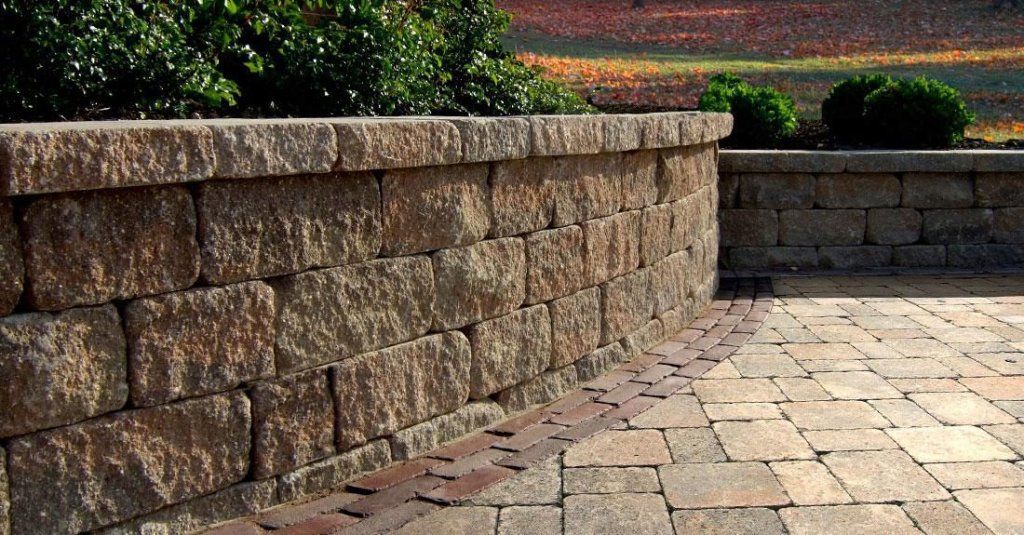
Identify the location of brick wall. (431, 266), (939, 253).